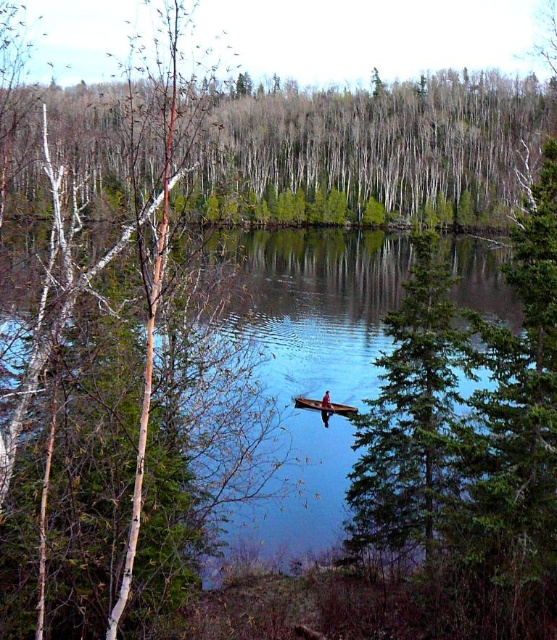
From the picture: You are planning to take a photo of the wooden canoe at center and the green leafy trees at upper center. Which object should you focus on first if you want to capture both in a single frame without moving the camera?

The green leafy trees at upper center are larger in size than the wooden canoe at center, so focusing on the larger trees first would ensure they are in frame while adjusting the camera to include the smaller canoe.

You are standing at the center of the lake in a small canoe. You see green leafy trees at upper center. What direction should you paddle to reach them?

You should paddle north because the green leafy trees at upper center are located north of your current position in the canoe.